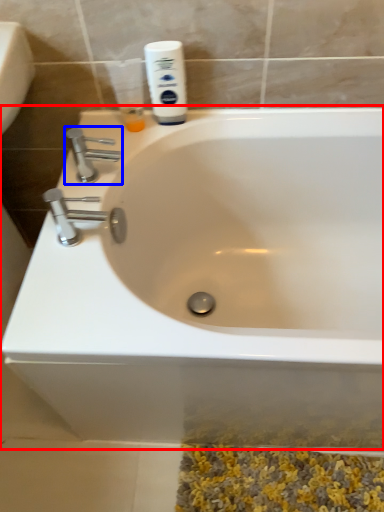
Question: Among these objects, which one is nearest to the camera, bathtub (highlighted by a red box) or tap (highlighted by a blue box)?

Choices:
 (A) bathtub
 (B) tap

Answer: (A)